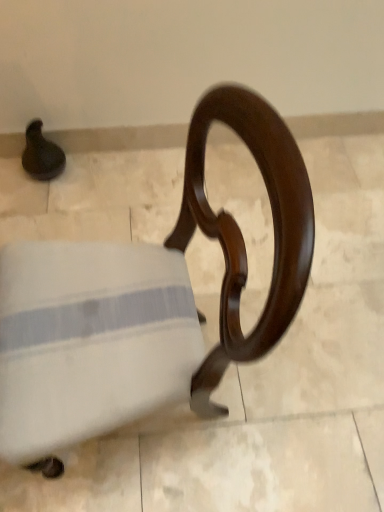
Describe the element at coordinates (146, 301) in the screenshot. The height and width of the screenshot is (512, 384). I see `polished dark wood chair at center` at that location.

What is the approximate height of polished dark wood chair at center?

The height of polished dark wood chair at center is 86.29 centimeters.

Identify the location of polished dark wood chair at center. The image size is (384, 512). (146, 301).

Locate an element on the screen. The width and height of the screenshot is (384, 512). polished dark wood chair at center is located at coordinates (146, 301).